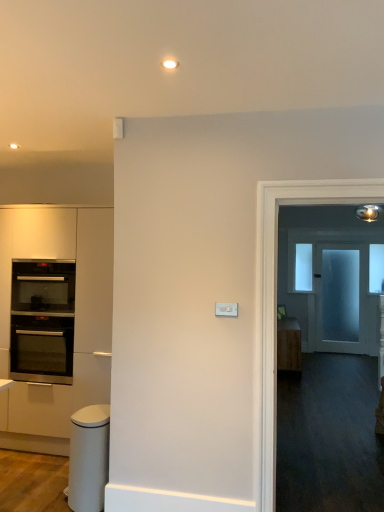
Identify the location of matte white cabinetry at left, the first cabinetry in the left-to-right sequence. (75, 321).

Measure the distance between frosted glass door at right and camera.

22.42 feet.

How much space does transparent glass window at upper center, the 2th window positioned from the front, occupy vertically?

transparent glass window at upper center, the 2th window positioned from the front, is 37.16 inches tall.

Where is `wooden cabinet at right, the first cabinetry when ordered from right to left`? The height and width of the screenshot is (512, 384). wooden cabinet at right, the first cabinetry when ordered from right to left is located at coordinates (289, 345).

How much space does stainless steel oven at left, positioned as the 2th oven in top-to-bottom order, occupy horizontally?

stainless steel oven at left, positioned as the 2th oven in top-to-bottom order, is 19.09 inches in width.

The height and width of the screenshot is (512, 384). What do you see at coordinates (42, 320) in the screenshot?
I see `stainless steel oven at left, positioned as the 2th oven in top-to-bottom order` at bounding box center [42, 320].

Identify the location of matte white cabinetry at left, acting as the 2th cabinetry starting from the back. The image size is (384, 512). (75, 321).

Would you say white glossy trash can at lower left is outside black glass oven at left, the 1th oven positioned from the top?

white glossy trash can at lower left is positioned outside black glass oven at left, the 1th oven positioned from the top.

Is white glossy trash can at lower left not close to black glass oven at left, the second oven in the bottom-to-top sequence?

Indeed, white glossy trash can at lower left is not near black glass oven at left, the second oven in the bottom-to-top sequence.

Between point (105, 439) and point (53, 300), which one is positioned behind?

The point (53, 300) is farther from the camera.

Is white glossy trash can at lower left turned away from black glass oven at left, the second oven in the bottom-to-top sequence?

No, white glossy trash can at lower left's orientation is not away from black glass oven at left, the second oven in the bottom-to-top sequence.

Is the depth of matte white cabinetry at left, the first cabinetry in the left-to-right sequence, greater than that of stainless steel oven at left, positioned as the 1th oven in bottom-to-top order?

That is False.

From a real-world perspective, is matte white cabinetry at left, placed as the first cabinetry when sorted from front to back, positioned under stainless steel oven at left, positioned as the 2th oven in top-to-bottom order, based on gravity?

No, from a real-world perspective, matte white cabinetry at left, placed as the first cabinetry when sorted from front to back, is not under stainless steel oven at left, positioned as the 2th oven in top-to-bottom order.

Between matte white cabinetry at left, the first cabinetry in the left-to-right sequence, and stainless steel oven at left, positioned as the 2th oven in top-to-bottom order, which one has larger width?

matte white cabinetry at left, the first cabinetry in the left-to-right sequence, is wider.

Does matte white cabinetry at left, placed as the first cabinetry when sorted from front to back, have a smaller size compared to stainless steel oven at left, positioned as the 1th oven in bottom-to-top order?

No.

Which of these two, matte white cabinetry at left, acting as the 2th cabinetry starting from the back, or black glass oven at left, the 1th oven positioned from the top, is thinner?

Thinner between the two is black glass oven at left, the 1th oven positioned from the top.

Is matte white cabinetry at left, acting as the 2th cabinetry starting from the back, inside the boundaries of black glass oven at left, the 1th oven positioned from the top, or outside?

The correct answer is: outside.

Does matte white cabinetry at left, the first cabinetry in the left-to-right sequence, have a smaller size compared to black glass oven at left, the 1th oven positioned from the top?

No.

In the scene shown: Does matte white cabinetry at left, the 2th cabinetry viewed from the right, have a greater height compared to transparent glass window at upper center, placed as the 1th window when sorted from back to front?

Indeed, matte white cabinetry at left, the 2th cabinetry viewed from the right, has a greater height compared to transparent glass window at upper center, placed as the 1th window when sorted from back to front.

From the image's perspective, which one is positioned lower, matte white cabinetry at left, placed as the first cabinetry when sorted from front to back, or transparent glass window at upper center, which is the 2th window from right to left?

matte white cabinetry at left, placed as the first cabinetry when sorted from front to back, from the image's perspective.

Based on their positions, is matte white cabinetry at left, the 2th cabinetry viewed from the right, located to the left or right of transparent glass window at upper center, the 2th window positioned from the front?

matte white cabinetry at left, the 2th cabinetry viewed from the right, is to the left of transparent glass window at upper center, the 2th window positioned from the front.

Between black glass oven at left, the second oven in the bottom-to-top sequence, and wooden cabinet at right, which appears as the second cabinetry when viewed from the left, which one has less height?

black glass oven at left, the second oven in the bottom-to-top sequence.

In the scene shown: Considering the sizes of objects black glass oven at left, the 1th oven positioned from the top, and wooden cabinet at right, marked as the 1th cabinetry in a back-to-front arrangement, in the image provided, who is bigger, black glass oven at left, the 1th oven positioned from the top, or wooden cabinet at right, marked as the 1th cabinetry in a back-to-front arrangement,?

wooden cabinet at right, marked as the 1th cabinetry in a back-to-front arrangement, is bigger.

Considering the points (38, 270) and (290, 320), which point is behind, point (38, 270) or point (290, 320)?

Positioned behind is point (290, 320).

Is black glass oven at left, the 1th oven positioned from the top, at the right side of wooden cabinet at right, the first cabinetry when ordered from right to left?

No, black glass oven at left, the 1th oven positioned from the top, is not to the right of wooden cabinet at right, the first cabinetry when ordered from right to left.

Based on the photo, how many degrees apart are the facing directions of transparent glass window at upper right, acting as the second window starting from the left, and white glossy trash can at lower left?

92 degrees.

Considering the relative sizes of transparent glass window at upper right, arranged as the second window when viewed from the back, and white glossy trash can at lower left in the image provided, is transparent glass window at upper right, arranged as the second window when viewed from the back, shorter than white glossy trash can at lower left?

In fact, transparent glass window at upper right, arranged as the second window when viewed from the back, may be taller than white glossy trash can at lower left.

From the image's perspective, is transparent glass window at upper right, marked as the 1th window in a right-to-left arrangement, positioned above or below white glossy trash can at lower left?

Clearly, from the image's perspective, transparent glass window at upper right, marked as the 1th window in a right-to-left arrangement, is above white glossy trash can at lower left.

Is transparent glass window at upper right, which is the first window from front to back, not near white glossy trash can at lower left?

Yes, transparent glass window at upper right, which is the first window from front to back, is far from white glossy trash can at lower left.

Is transparent glass window at upper right, acting as the second window starting from the left, inside frosted glass door at right?

That's incorrect, transparent glass window at upper right, acting as the second window starting from the left, is not inside frosted glass door at right.

Does frosted glass door at right appear on the right side of transparent glass window at upper right, acting as the second window starting from the left?

Incorrect, frosted glass door at right is not on the right side of transparent glass window at upper right, acting as the second window starting from the left.

From a real-world perspective, is frosted glass door at right physically below transparent glass window at upper right, arranged as the second window when viewed from the back?

Indeed, from a real-world perspective, frosted glass door at right is positioned beneath transparent glass window at upper right, arranged as the second window when viewed from the back.

Who is more distant, frosted glass door at right or transparent glass window at upper right, acting as the second window starting from the left?

transparent glass window at upper right, acting as the second window starting from the left.

What are the coordinates of `oven that is the 2nd object above the white glossy trash can at lower left (from a real-world perspective)` in the screenshot? It's located at (43, 285).

Where is `cabinetry located above the stainless steel oven at left, positioned as the 2th oven in top-to-bottom order (from the image's perspective)`? cabinetry located above the stainless steel oven at left, positioned as the 2th oven in top-to-bottom order (from the image's perspective) is located at coordinates (75, 321).

Estimate the real-world distances between objects in this image. Which object is further from white glossy trash can at lower left, black glass oven at left, the 1th oven positioned from the top, or transparent glass window at upper center, which is the 2th window from right to left?

Based on the image, transparent glass window at upper center, which is the 2th window from right to left, appears to be further to white glossy trash can at lower left.

From the image, which object appears to be farther from stainless steel oven at left, positioned as the 1th oven in bottom-to-top order, transparent glass window at upper center, placed as the 1th window when sorted from back to front, or white glossy trash can at lower left?

transparent glass window at upper center, placed as the 1th window when sorted from back to front.

From the image, which object appears to be farther from black glass oven at left, the 1th oven positioned from the top, transparent glass window at upper right, acting as the second window starting from the left, or matte white cabinetry at left, acting as the 2th cabinetry starting from the back?

transparent glass window at upper right, acting as the second window starting from the left, lies further to black glass oven at left, the 1th oven positioned from the top, than the other object.

From the image, which object appears to be farther from wooden cabinet at right, which appears as the second cabinetry when viewed from the left, transparent glass window at upper center, the 2th window positioned from the front, or transparent glass window at upper right, marked as the 1th window in a right-to-left arrangement?

transparent glass window at upper right, marked as the 1th window in a right-to-left arrangement, is further to wooden cabinet at right, which appears as the second cabinetry when viewed from the left.

Based on their spatial positions, is transparent glass window at upper center, the first window when ordered from left to right, or matte white cabinetry at left, acting as the 2th cabinetry starting from the back, further from frosted glass door at right?

The object further to frosted glass door at right is matte white cabinetry at left, acting as the 2th cabinetry starting from the back.

Considering their positions, is wooden cabinet at right, marked as the 1th cabinetry in a back-to-front arrangement, positioned further to transparent glass window at upper center, the 2th window positioned from the front, than stainless steel oven at left, positioned as the 1th oven in bottom-to-top order?

stainless steel oven at left, positioned as the 1th oven in bottom-to-top order, is positioned further to the anchor transparent glass window at upper center, the 2th window positioned from the front.

Based on their spatial positions, is stainless steel oven at left, positioned as the 2th oven in top-to-bottom order, or wooden cabinet at right, marked as the 1th cabinetry in a back-to-front arrangement, closer to transparent glass window at upper right, marked as the 1th window in a right-to-left arrangement?

wooden cabinet at right, marked as the 1th cabinetry in a back-to-front arrangement, lies closer to transparent glass window at upper right, marked as the 1th window in a right-to-left arrangement, than the other object.

Based on the photo, estimate the real-world distances between objects in this image. Which object is further from white glossy trash can at lower left, transparent glass window at upper center, the first window when ordered from left to right, or wooden cabinet at right, the first cabinetry when ordered from right to left?

Based on the image, transparent glass window at upper center, the first window when ordered from left to right, appears to be further to white glossy trash can at lower left.

You are a GUI agent. You are given a task and a screenshot of the screen. Output one action in this format:
    pyautogui.click(x=<x>, y=<y>)
    Task: Click on the cabinetry between black glass oven at left, the 1th oven positioned from the top, and white glossy trash can at lower left vertically
    
    Given the screenshot: What is the action you would take?
    pyautogui.click(x=75, y=321)

Identify the location of window between stainless steel oven at left, positioned as the 1th oven in bottom-to-top order, and transparent glass window at upper center, placed as the 1th window when sorted from back to front, in the front-back direction. This screenshot has width=384, height=512. (376, 268).

The image size is (384, 512). Identify the location of door between wooden cabinet at right, the first cabinetry when ordered from right to left, and transparent glass window at upper center, the 2th window positioned from the front, from front to back. (341, 297).

Identify the location of window between white glossy trash can at lower left and transparent glass window at upper center, which is the 2th window from right to left, in the front-back direction. (376, 268).